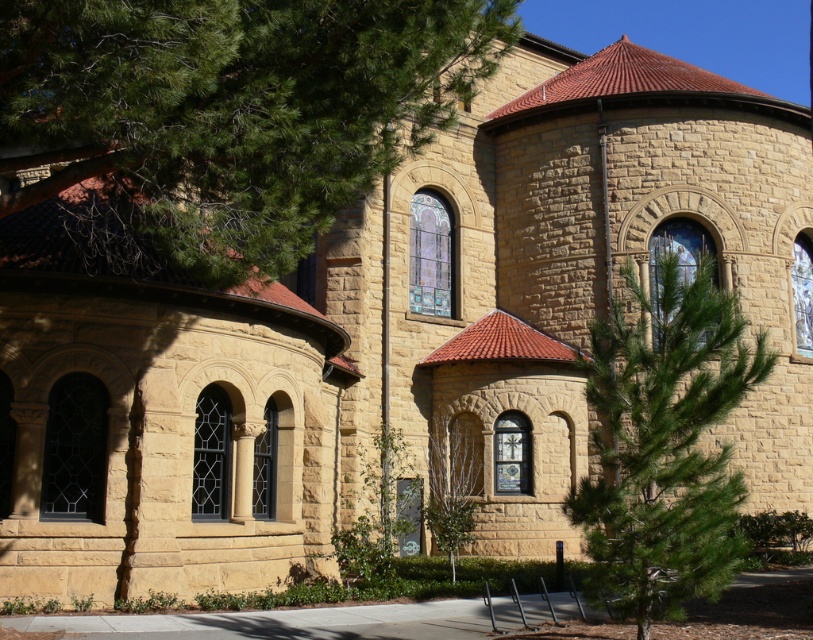
Does green leafy tree at upper left appear over green needle-like tree at center?

Yes, green leafy tree at upper left is above green needle-like tree at center.

Can you confirm if green leafy tree at upper left is positioned to the left of green needle-like tree at center?

Indeed, green leafy tree at upper left is positioned on the left side of green needle-like tree at center.

Does point (394, 51) come behind point (650, 605)?

Yes, point (394, 51) is behind point (650, 605).

Identify the location of green leafy tree at upper left. (227, 115).

Between point (214, 64) and point (441, 467), which one is positioned in front?

Positioned in front is point (214, 64).

Is green leafy tree at upper left wider than green leafy tree at center?

Yes.

Describe the element at coordinates (227, 115) in the screenshot. I see `green leafy tree at upper left` at that location.

Identify the location of green leafy tree at upper left. The image size is (813, 640). (227, 115).

Is green needle-like tree at center wider than green leafy tree at center?

Indeed, green needle-like tree at center has a greater width compared to green leafy tree at center.

Between point (598, 433) and point (438, 458), which one is positioned in front?

Point (598, 433)

Which is in front, point (620, 502) or point (441, 458)?

Point (620, 502)

At what (x,y) coordinates should I click in order to perform the action: click on green needle-like tree at center. Please return your answer as a coordinate pair (x, y). The image size is (813, 640). Looking at the image, I should click on (664, 442).